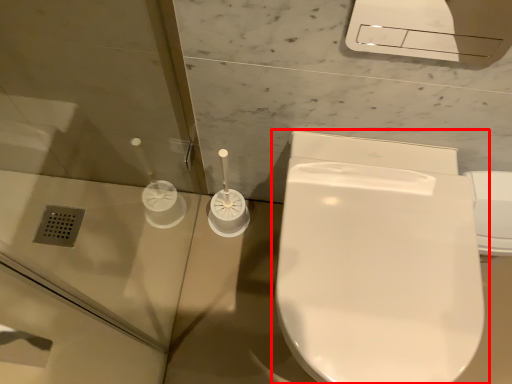
Question: From the image's perspective, considering the relative positions of toilet (annotated by the red box) and screen door in the image provided, where is toilet (annotated by the red box) located with respect to the staircase?

Choices:
 (A) above
 (B) below

Answer: (B)